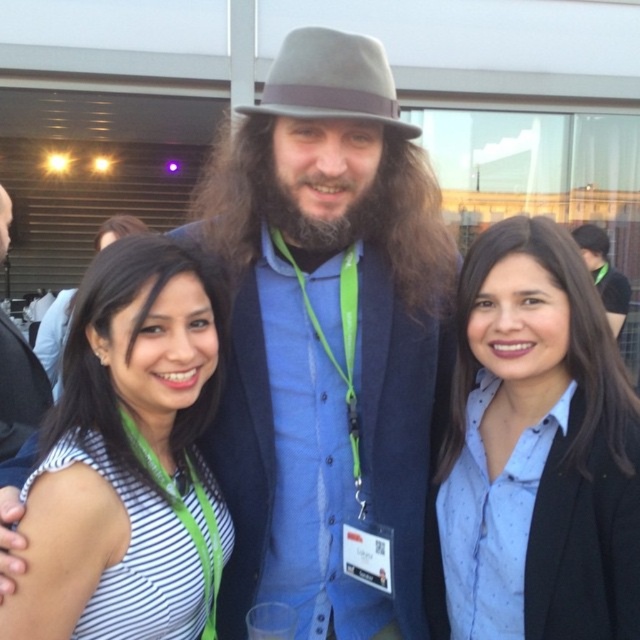
Does matte gray fedora at center have a greater width compared to felt fedora at center?

Yes, matte gray fedora at center is wider than felt fedora at center.

This screenshot has width=640, height=640. I want to click on matte gray fedora at center, so click(328, 342).

Can you confirm if brown fuzzy beard at center is smaller than dark brown hair at center?

Yes.

Image resolution: width=640 pixels, height=640 pixels. What do you see at coordinates (316, 218) in the screenshot?
I see `brown fuzzy beard at center` at bounding box center [316, 218].

Locate an element on the screen. The width and height of the screenshot is (640, 640). brown fuzzy beard at center is located at coordinates (316, 218).

Which is behind, point (529, 328) or point (620, 301)?

The point (620, 301) is behind.

Is point (497, 250) positioned in front of point (614, 272)?

That is True.

Where is `blue dotted shirt at center`? blue dotted shirt at center is located at coordinates (536, 442).